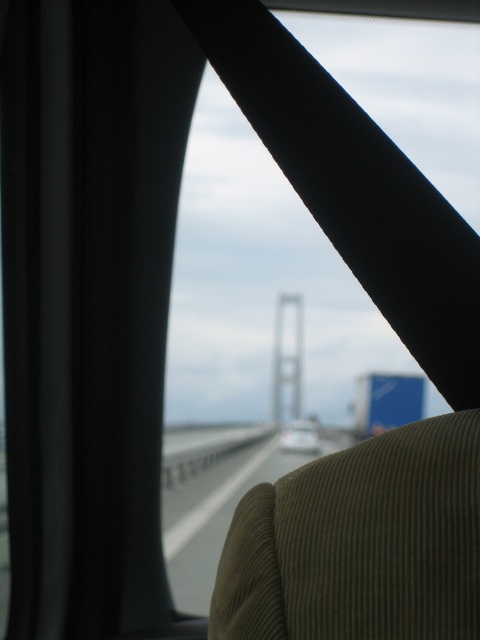
In the scene shown: You are driving a car and see the white glossy car at center ahead of you on the white asphalt highway at center. Which object is closer to the left side of the road?

The white asphalt highway at center is to the left of the white glossy car at center, so the white asphalt highway at center is closer to the left side of the road.